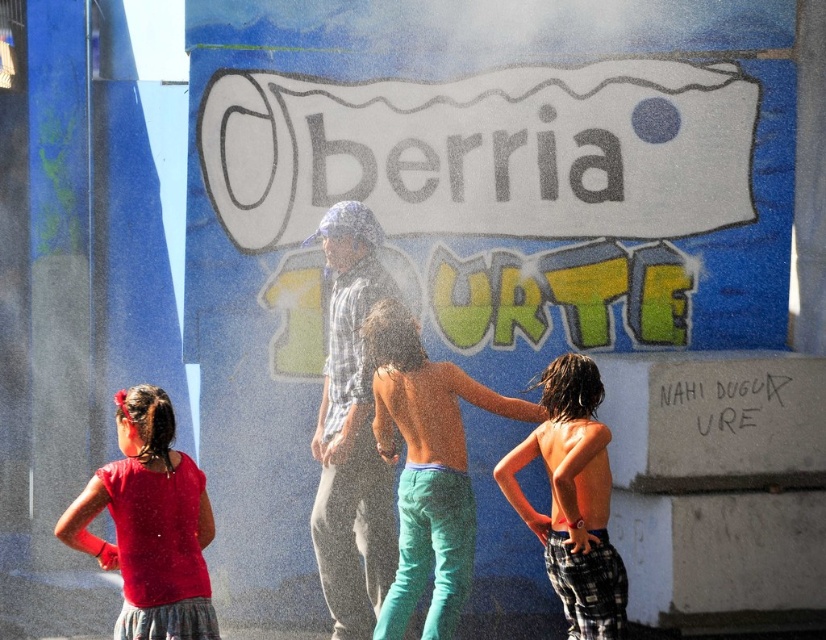
You are a photographer trying to capture the blue wall with graffiti in the background. You notice the matte red shirt at lower left and plaid cotton shorts at center are blocking the view. Which object should you move to get a clearer shot of the wall?

You should move the matte red shirt at lower left because it is in front of the plaid cotton shorts at center, obstructing the view of the wall.

You are a photographer trying to capture a closeup of the graffiti on the blue wall. You notice two items in the foreground that might block your shot. The matte red shirt at lower left and the plaid cotton shorts at center. Which item is wider and might block more of the graffiti?

The matte red shirt at lower left is wider than the plaid cotton shorts at center, so it might block more of the graffiti.